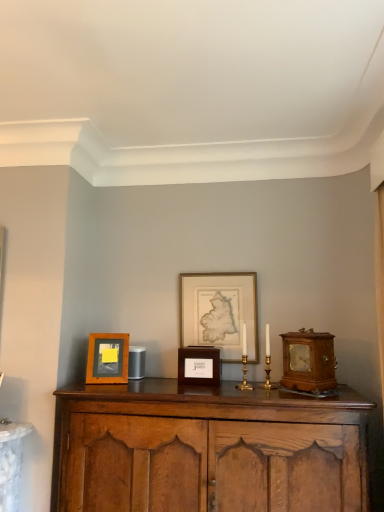
Image resolution: width=384 pixels, height=512 pixels. I want to click on free location to the right of wooden frame at left, the 1th picture frame positioned from the left, so pyautogui.click(x=152, y=380).